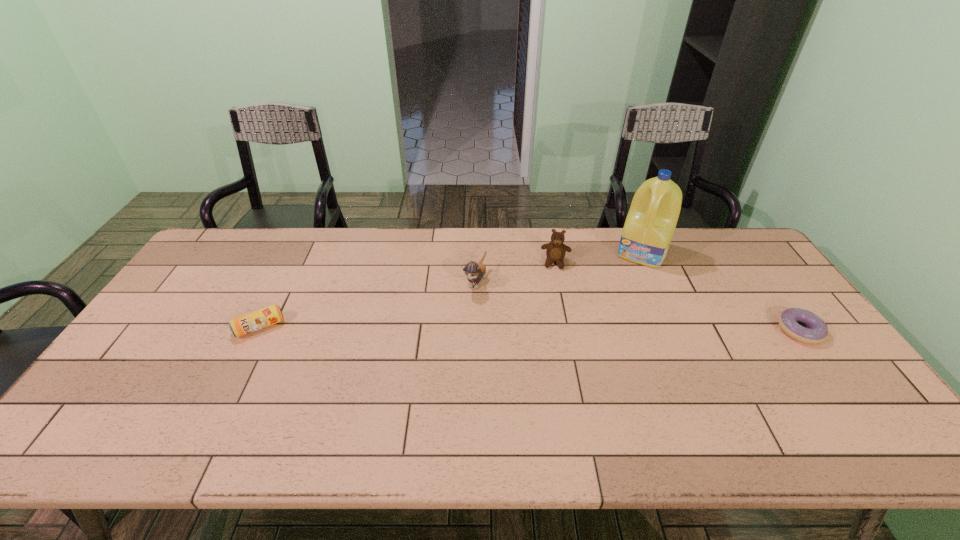
Locate an element on the screen. Image resolution: width=960 pixels, height=540 pixels. kitten at the far edge is located at coordinates (474, 272).

The image size is (960, 540). What are the coordinates of `teddy bear that is at the far edge` in the screenshot? It's located at (555, 250).

In order to click on object that is at the right edge in this screenshot , I will do `click(817, 331)`.

Find the location of a particular element. The width and height of the screenshot is (960, 540). vacant space at the far edge of the desktop is located at coordinates (471, 239).

In the image, there is a desktop. In order to click on vacant space at the near edge in this screenshot , I will do `click(695, 384)`.

The width and height of the screenshot is (960, 540). What are the coordinates of `vacant region at the left edge` in the screenshot? It's located at (211, 298).

Locate an element on the screen. The width and height of the screenshot is (960, 540). vacant space at the right edge is located at coordinates (777, 305).

Identify the location of vacant space at the far left corner of the desktop. This screenshot has width=960, height=540. (221, 240).

Identify the location of free spot at the far right corner of the desktop. The image size is (960, 540). (715, 229).

Where is `free space that is in between the second object from right to left and the teddy bear`? free space that is in between the second object from right to left and the teddy bear is located at coordinates (599, 257).